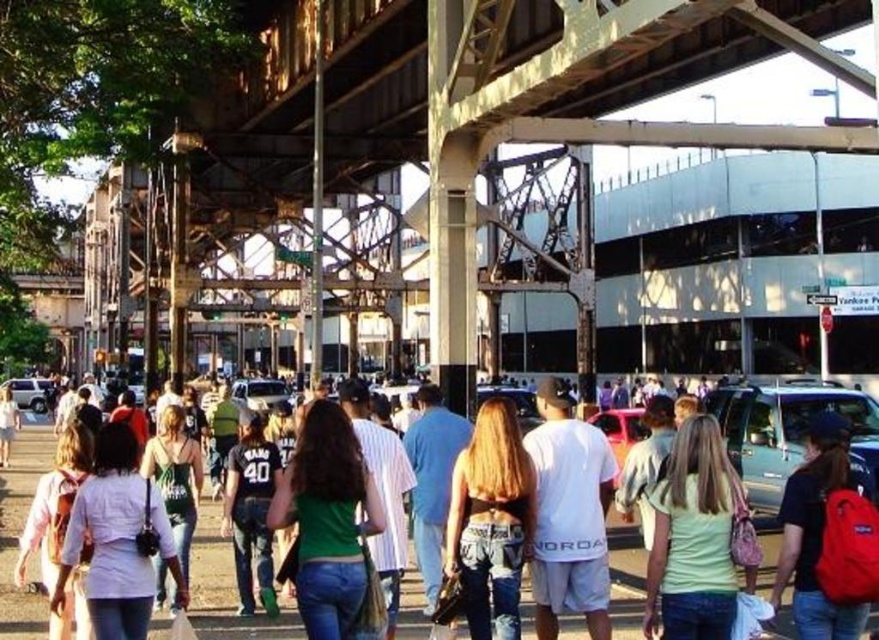
Question: Which point is closer to the camera?

Choices:
 (A) green matte shirt at center
 (B) white cotton t-shirt at center

Answer: (A)

Question: Is the position of white cotton t-shirt at center less distant than that of white matte shirt at center?

Choices:
 (A) no
 (B) yes

Answer: (A)

Question: Is denim jeans at center to the left of denim shorts at center from the viewer's perspective?

Choices:
 (A) yes
 (B) no

Answer: (A)

Question: Which of the following is the closest to the observer?

Choices:
 (A) green matte shirt at center
 (B) white matte shirt at center

Answer: (B)

Question: Can you confirm if denim jeans at center is positioned above light green t-shirt at center?

Choices:
 (A) yes
 (B) no

Answer: (B)

Question: Which object is farther from the camera taking this photo?

Choices:
 (A) metallic steel bridge at center
 (B) denim shorts at center
 (C) green matte shirt at center

Answer: (A)